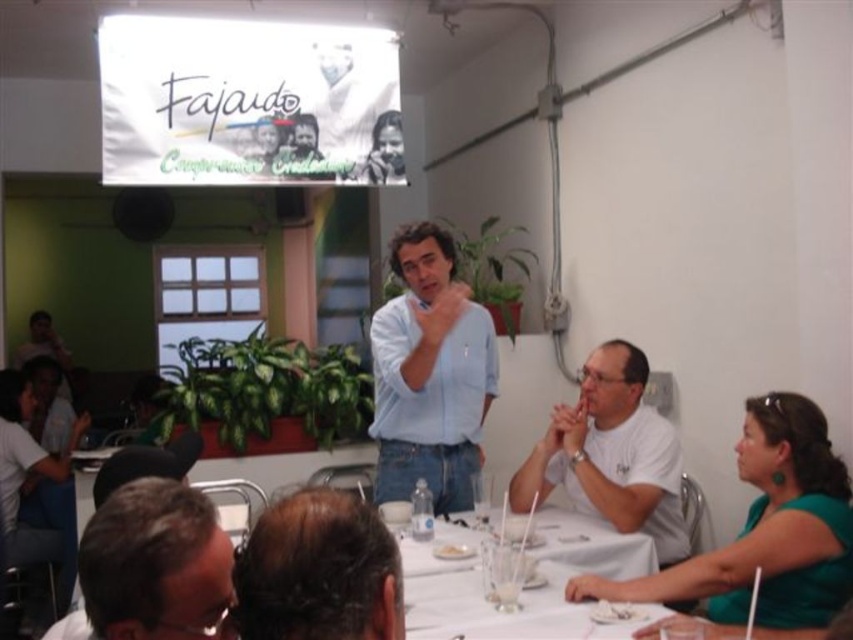
Question: Which point is farther to the camera?

Choices:
 (A) brown hair at lower left
 (B) white matte shirt at lower right

Answer: (B)

Question: Does white matte shirt at lower right appear over white glossy table at center?

Choices:
 (A) yes
 (B) no

Answer: (A)

Question: Estimate the real-world distances between objects in this image. Which object is closer to the brown hair at lower left?

Choices:
 (A) light blue shirt at center
 (B) white matte plate at center

Answer: (B)

Question: Does white matte shirt at lower right appear on the left side of white glossy table at center?

Choices:
 (A) yes
 (B) no

Answer: (B)

Question: Observing the image, what is the correct spatial positioning of white matte shirt at lower right in reference to white matte plate at center?

Choices:
 (A) right
 (B) left

Answer: (A)

Question: Which point is farther to the camera?

Choices:
 (A) brown hair at lower left
 (B) white glossy table at center
 (C) white matte shirt at lower right

Answer: (C)